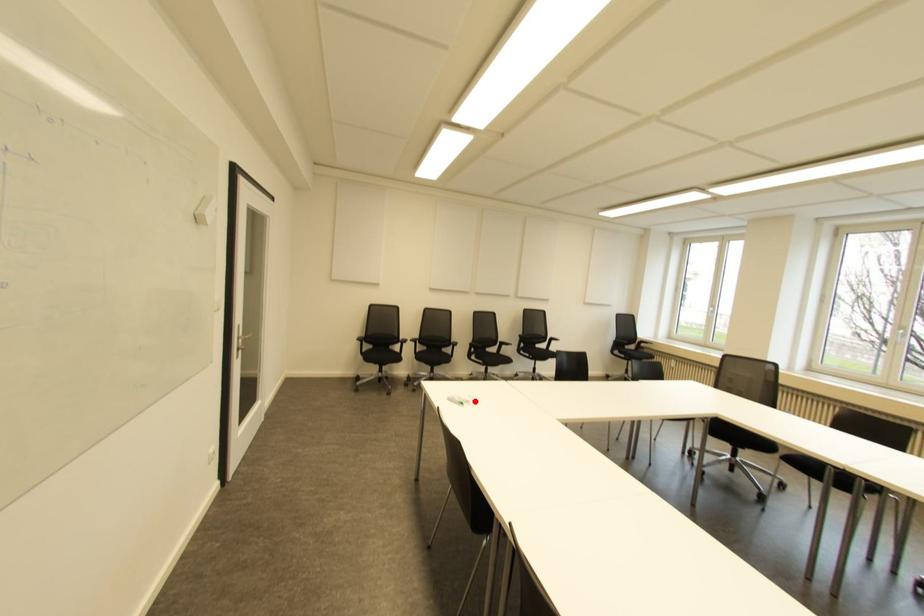
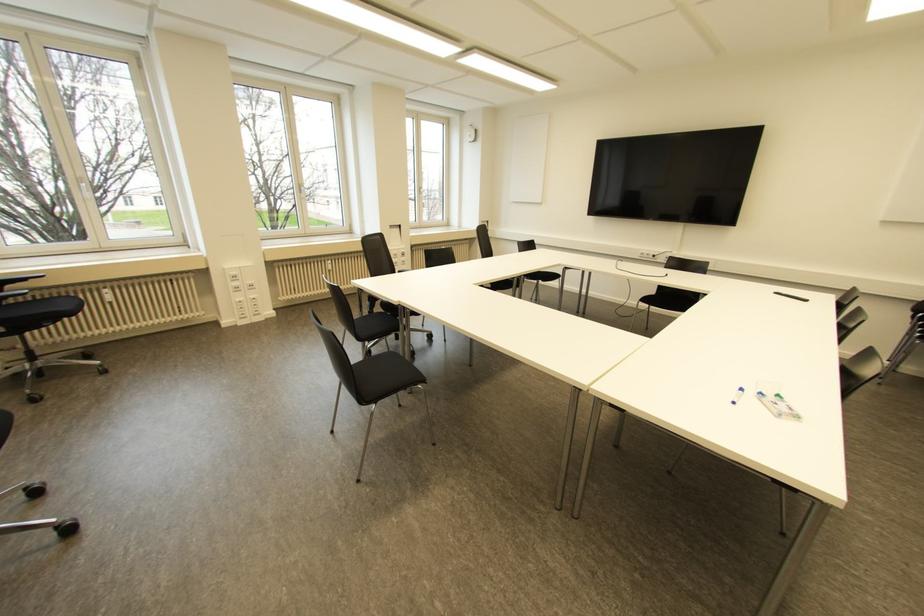
Where in the second image is the point corresponding to the highlighted location from the first image?

(739, 390)